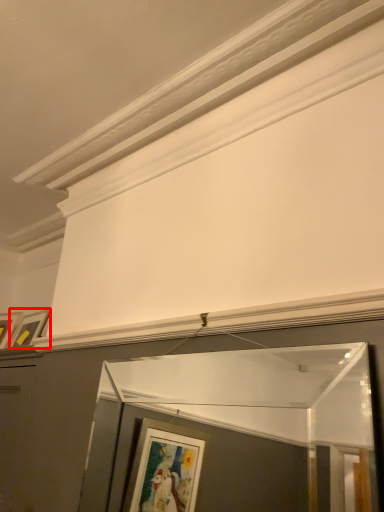
Question: From the image, what is the correct spatial relationship of picture frame (annotated by the red box) in relation to window frame?

Choices:
 (A) left
 (B) right

Answer: (A)